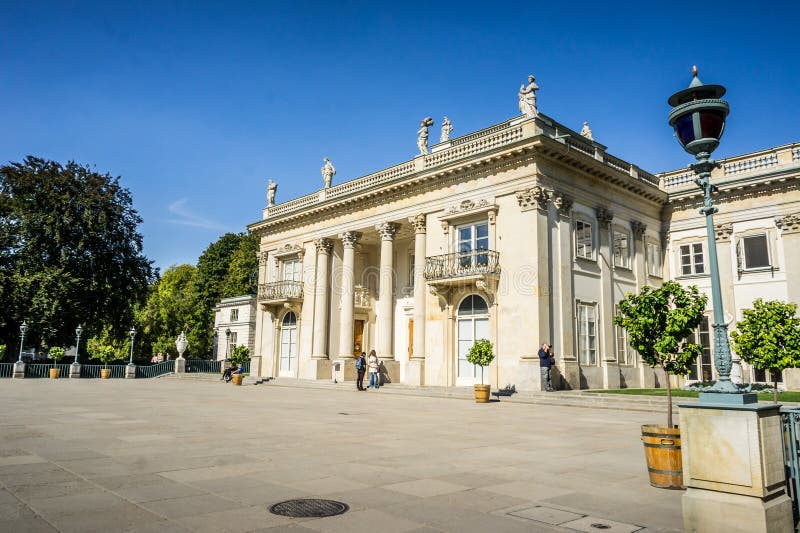
Locate an element on the screen. planter is located at coordinates (666, 460), (484, 395).